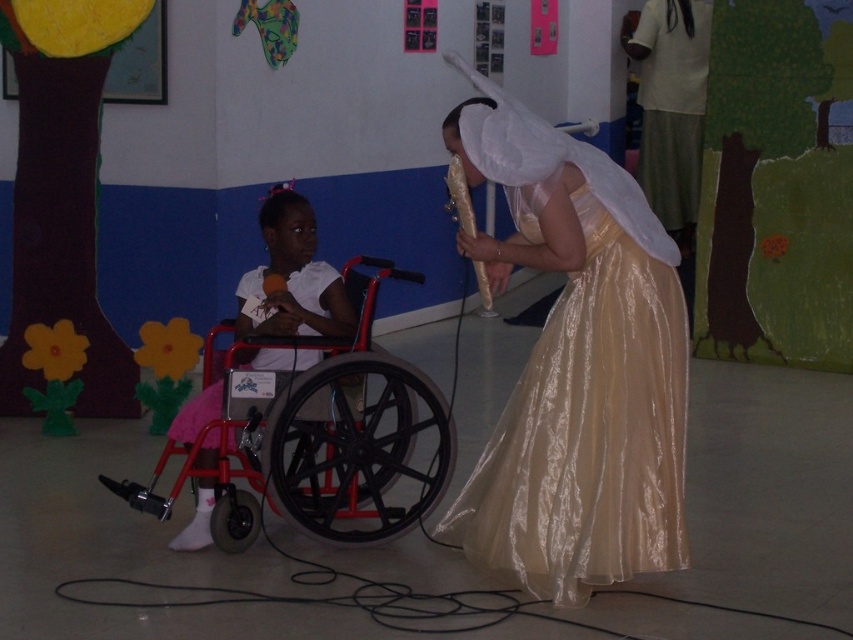
Based on the photo, can you confirm if red plastic wheelchair at left is taller than white satin dress at left?

Yes.

Can you confirm if red plastic wheelchair at left is positioned to the right of white satin dress at left?

Yes, red plastic wheelchair at left is to the right of white satin dress at left.

Is point (428, 387) farther from viewer compared to point (331, 273)?

No.

Where is `red plastic wheelchair at left`? The height and width of the screenshot is (640, 853). red plastic wheelchair at left is located at coordinates (346, 435).

Between point (654, 518) and point (252, 362), which one is positioned behind?

Point (252, 362)

Describe the element at coordinates (585, 419) in the screenshot. I see `shiny gold dress at center` at that location.

Does point (519, 202) come farther from viewer compared to point (311, 276)?

No, (519, 202) is closer to viewer.

Where is `shiny gold dress at center`? This screenshot has width=853, height=640. shiny gold dress at center is located at coordinates (585, 419).

Is pink satin dress at left taller than white satin dress at left?

Yes.

Between pink satin dress at left and white satin dress at left, which one is positioned lower?

pink satin dress at left

The height and width of the screenshot is (640, 853). Describe the element at coordinates (292, 276) in the screenshot. I see `pink satin dress at left` at that location.

The height and width of the screenshot is (640, 853). Identify the location of pink satin dress at left. (292, 276).